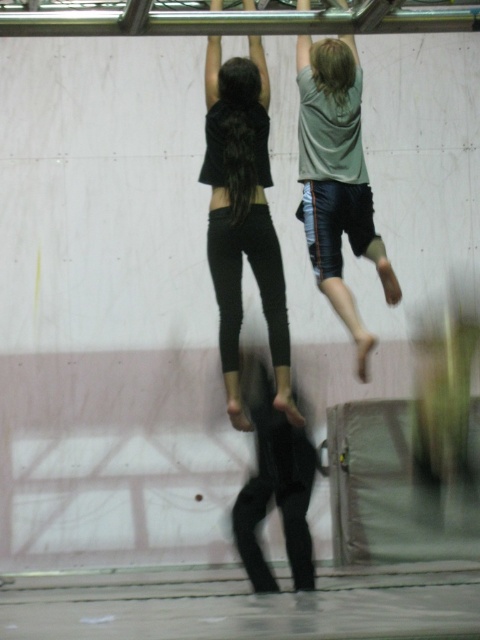
Does black matte leggings at center have a greater height compared to light gray cotton shirt at upper right?

Indeed, black matte leggings at center has a greater height compared to light gray cotton shirt at upper right.

Does point (205, 60) come closer to viewer compared to point (330, 276)?

That is False.

The width and height of the screenshot is (480, 640). Describe the element at coordinates (242, 216) in the screenshot. I see `black matte leggings at center` at that location.

Identify the location of black matte leggings at center. (242, 216).

Based on the photo, who is positioned more to the right, black matte leggings at center or black matte pants at center?

black matte pants at center is more to the right.

Which is behind, point (266, 164) or point (300, 481)?

Point (266, 164)

Where is `black matte leggings at center`? black matte leggings at center is located at coordinates (242, 216).

Can you confirm if light gray cotton shirt at upper right is positioned above black matte pants at center?

Correct, light gray cotton shirt at upper right is located above black matte pants at center.

Who is more distant from viewer, [336,262] or [324,472]?

Positioned behind is point [324,472].

I want to click on light gray cotton shirt at upper right, so click(x=333, y=113).